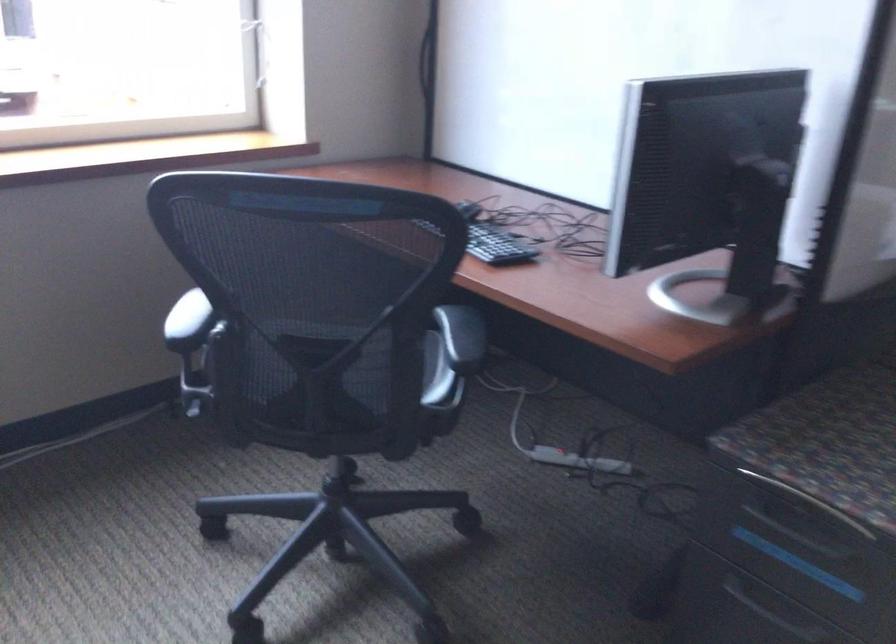
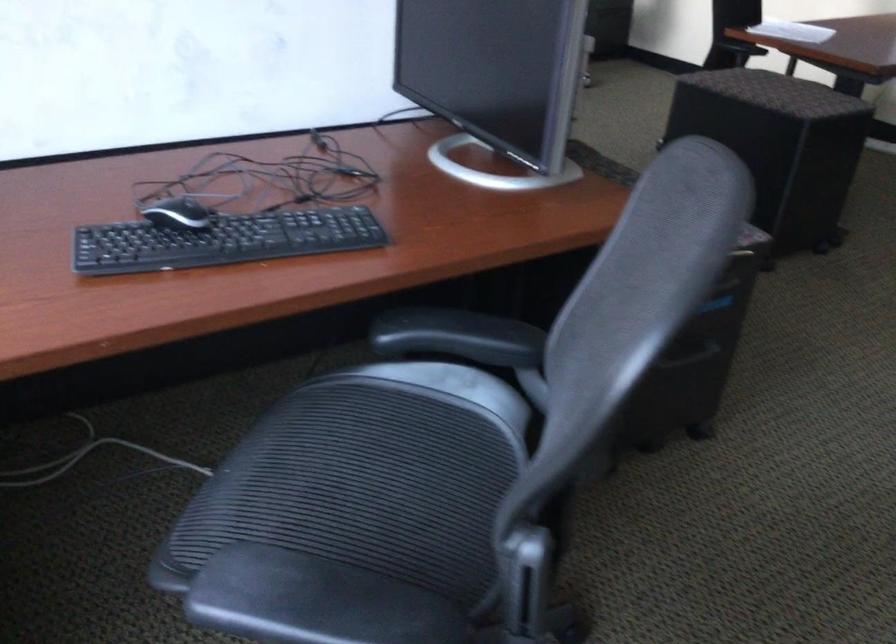
Question: I am providing you with two images of the same scene from different viewpoints. Please identify which objects are invisible in image2.

Choices:
 (A) black storage ottoman
 (B) water filter handle
 (C) black keyboard
 (D) recessed drawer handle

Answer: (D)